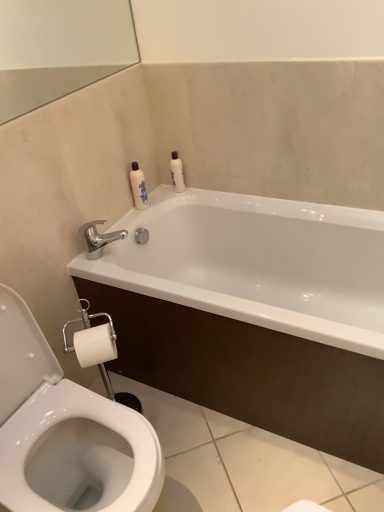
Question: Considering the positions of white glossy bathtub at upper center and polished metallic faucet at upper left in the image, is white glossy bathtub at upper center wider or thinner than polished metallic faucet at upper left?

Choices:
 (A) thin
 (B) wide

Answer: (B)

Question: Would you say white glossy bathtub at upper center is inside or outside polished metallic faucet at upper left?

Choices:
 (A) inside
 (B) outside

Answer: (B)

Question: Based on their relative distances, which object is farther from the white glossy bottle at upper center, the 2th toiletry in the right-to-left sequence?

Choices:
 (A) white glossy bathtub at upper center
 (B) white glossy bottle at upper right, arranged as the first toiletry when viewed from the right
 (C) polished metallic faucet at upper left

Answer: (A)

Question: Estimate the real-world distances between objects in this image. Which object is farther from the white glossy bathtub at upper center?

Choices:
 (A) white glossy bottle at upper center, the 1th toiletry positioned from the left
 (B) polished metallic faucet at upper left
 (C) white glossy bottle at upper right, placed as the second toiletry when sorted from left to right

Answer: (C)